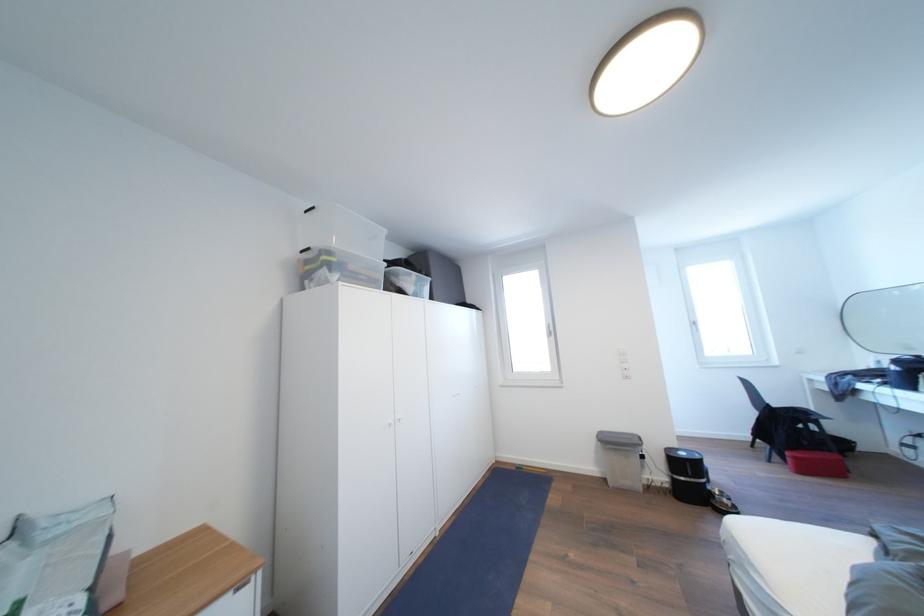
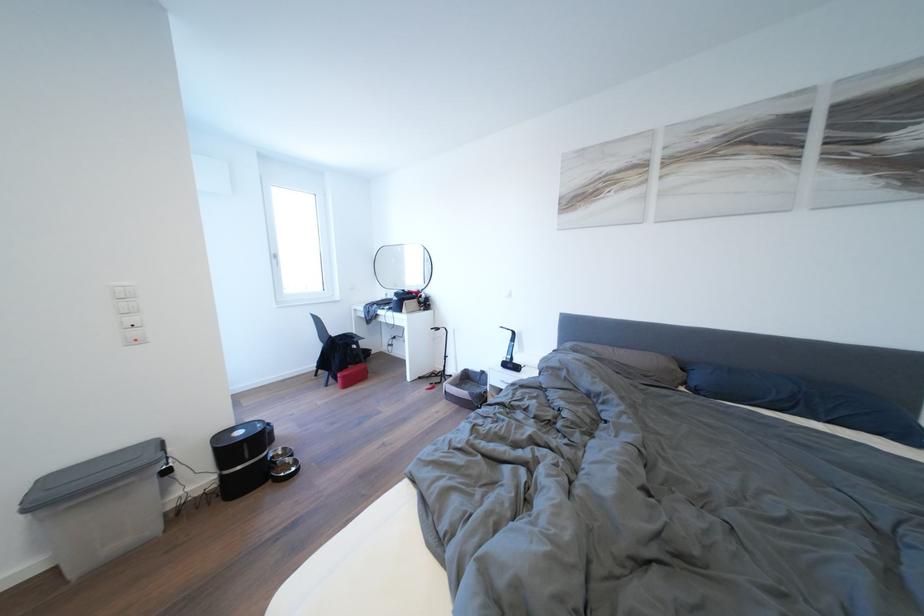
Locate, in the second image, the point that corresponds to the point at 701,329 in the first image.

(284, 261)